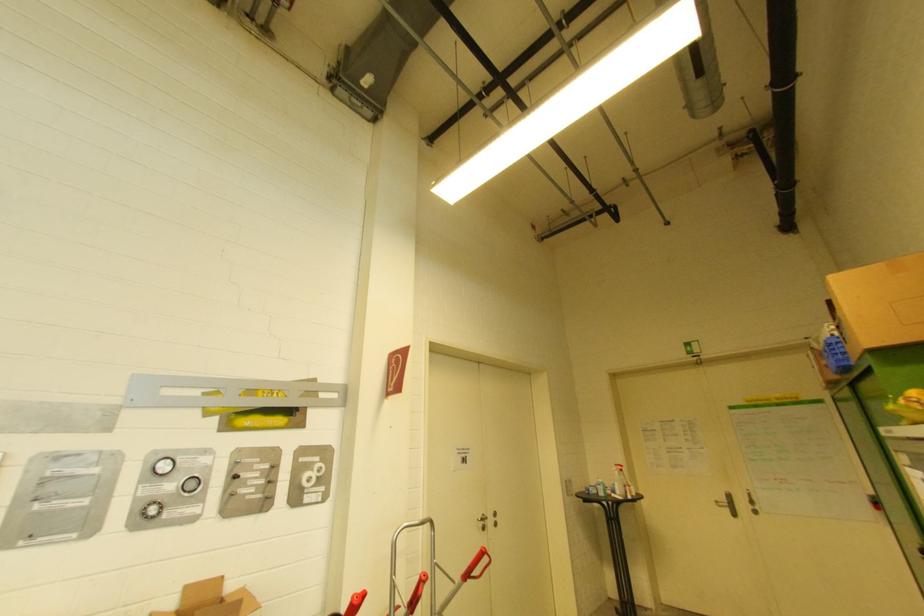
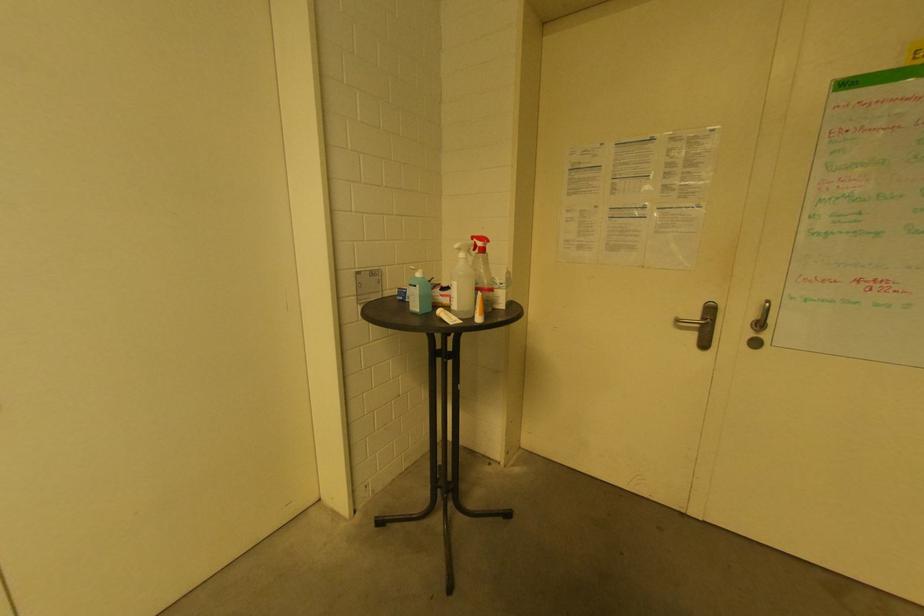
In the second image, find the point that corresponds to point (630, 498) in the first image.

(480, 321)